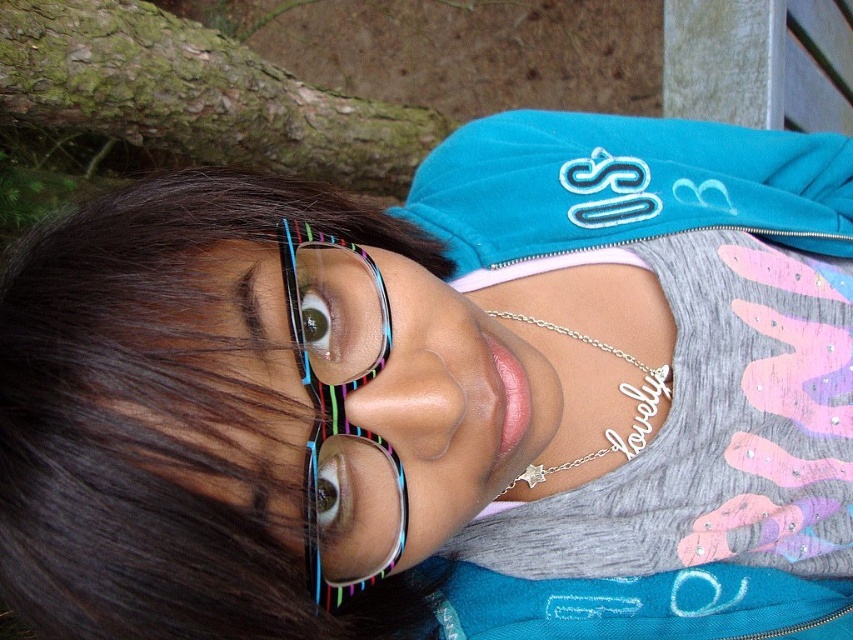
Which is behind, point (410, 625) or point (343, 340)?

The point (410, 625) is behind.

Is multicolored plastic glasses at upper left smaller than rainbow striped glasses at center?

No.

Is point (51, 435) positioned behind point (384, 292)?

No, it is not.

The height and width of the screenshot is (640, 853). I want to click on multicolored plastic glasses at upper left, so click(163, 422).